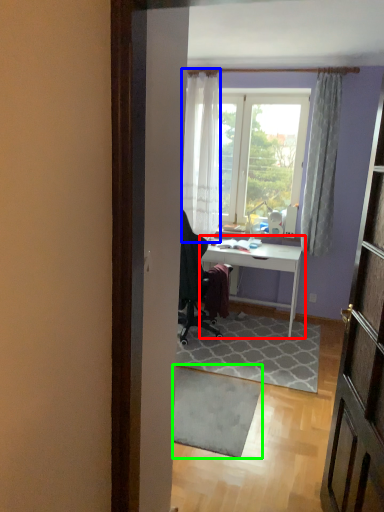
Question: Based on their relative distances, which object is nearer to desk (highlighted by a red box)? Choose from curtain (highlighted by a blue box) and doormat (highlighted by a green box).

Choices:
 (A) curtain
 (B) doormat

Answer: (A)